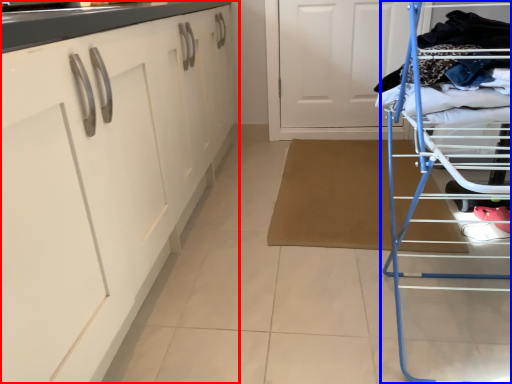
Question: Which object is further to the camera taking this photo, cabinetry (highlighted by a red box) or furniture (highlighted by a blue box)?

Choices:
 (A) cabinetry
 (B) furniture

Answer: (B)